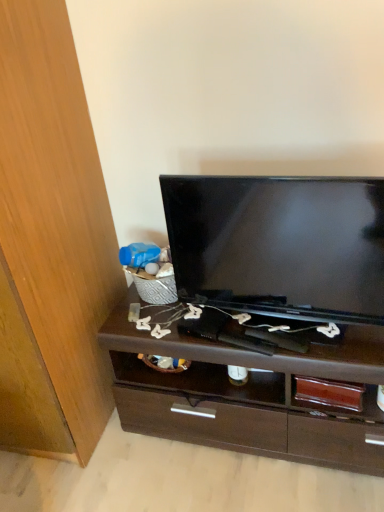
Question: Is black glossy television at center taller than wooden cabinet at left?

Choices:
 (A) no
 (B) yes

Answer: (A)

Question: Is black glossy television at center smaller than wooden cabinet at left?

Choices:
 (A) yes
 (B) no

Answer: (A)

Question: Are black glossy television at center and wooden cabinet at left located far from each other?

Choices:
 (A) no
 (B) yes

Answer: (A)

Question: Is the position of black glossy television at center less distant than that of wooden cabinet at left?

Choices:
 (A) yes
 (B) no

Answer: (B)

Question: From a real-world perspective, is black glossy television at center positioned over wooden cabinet at left based on gravity?

Choices:
 (A) yes
 (B) no

Answer: (A)

Question: Does black glossy television at center have a larger size compared to wooden cabinet at left?

Choices:
 (A) no
 (B) yes

Answer: (A)

Question: Is dark brown wood chest of drawers at center positioned behind wooden cabinet at left?

Choices:
 (A) yes
 (B) no

Answer: (A)

Question: Is dark brown wood chest of drawers at center wider than wooden cabinet at left?

Choices:
 (A) yes
 (B) no

Answer: (B)

Question: Is dark brown wood chest of drawers at center facing towards wooden cabinet at left?

Choices:
 (A) yes
 (B) no

Answer: (B)

Question: Is wooden cabinet at left completely or partially inside dark brown wood chest of drawers at center?

Choices:
 (A) no
 (B) yes

Answer: (A)

Question: From the image's perspective, would you say dark brown wood chest of drawers at center is shown under wooden cabinet at left?

Choices:
 (A) no
 (B) yes

Answer: (B)

Question: Is dark brown wood chest of drawers at center at the left side of wooden cabinet at left?

Choices:
 (A) no
 (B) yes

Answer: (A)

Question: From the image's perspective, is black glossy television at center on top of dark brown wood chest of drawers at center?

Choices:
 (A) yes
 (B) no

Answer: (A)